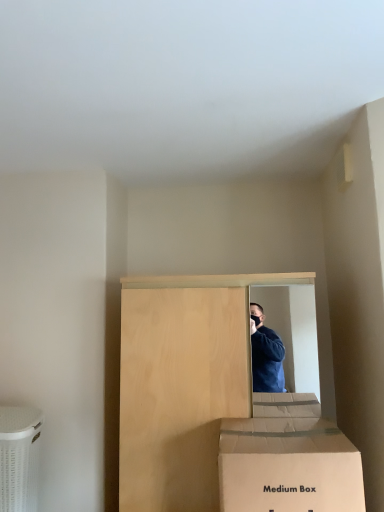
Question: Should I look upward or downward to see bare wood cabinet at center?

Choices:
 (A) up
 (B) down

Answer: (B)

Question: Is bare wood cabinet at center closer to the viewer compared to cardboard box at lower left?

Choices:
 (A) no
 (B) yes

Answer: (B)

Question: Can you confirm if bare wood cabinet at center is smaller than cardboard box at lower left?

Choices:
 (A) yes
 (B) no

Answer: (B)

Question: Considering the relative sizes of bare wood cabinet at center and cardboard box at lower left in the image provided, is bare wood cabinet at center taller than cardboard box at lower left?

Choices:
 (A) yes
 (B) no

Answer: (A)

Question: Is bare wood cabinet at center positioned with its back to cardboard box at lower left?

Choices:
 (A) yes
 (B) no

Answer: (B)

Question: From the image's perspective, is bare wood cabinet at center beneath cardboard box at lower left?

Choices:
 (A) yes
 (B) no

Answer: (B)

Question: From a real-world perspective, is bare wood cabinet at center physically above cardboard box at lower left?

Choices:
 (A) yes
 (B) no

Answer: (A)

Question: From a real-world perspective, is white cardboard box at lower center under bare wood cabinet at center?

Choices:
 (A) yes
 (B) no

Answer: (A)

Question: Is white cardboard box at lower center beside bare wood cabinet at center?

Choices:
 (A) no
 (B) yes

Answer: (A)

Question: Is white cardboard box at lower center taller than bare wood cabinet at center?

Choices:
 (A) yes
 (B) no

Answer: (B)

Question: Is white cardboard box at lower center positioned in front of bare wood cabinet at center?

Choices:
 (A) no
 (B) yes

Answer: (B)

Question: From the image's perspective, does white cardboard box at lower center appear higher than bare wood cabinet at center?

Choices:
 (A) no
 (B) yes

Answer: (A)

Question: Does white cardboard box at lower center have a lesser width compared to bare wood cabinet at center?

Choices:
 (A) yes
 (B) no

Answer: (A)

Question: Considering the relative sizes of bare wood cabinet at center and white cardboard box at lower center in the image provided, is bare wood cabinet at center taller than white cardboard box at lower center?

Choices:
 (A) no
 (B) yes

Answer: (B)